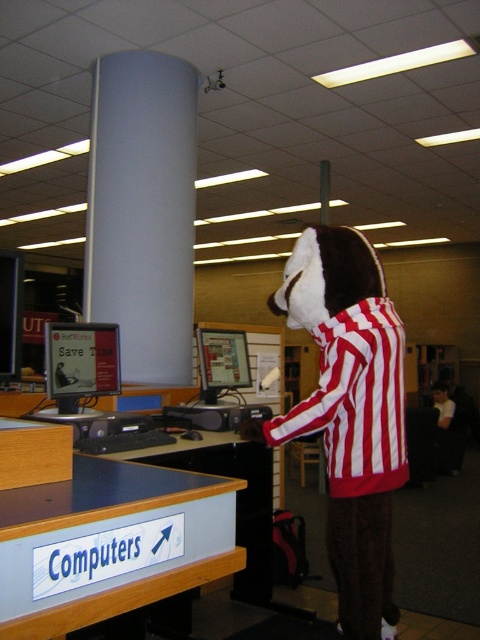
Is white smooth pillar at center thinner than matte black monitor at center?

Incorrect, white smooth pillar at center's width is not less than matte black monitor at center's.

Is point (192, 148) more distant than point (97, 384)?

Yes, point (192, 148) is behind point (97, 384).

This screenshot has width=480, height=640. Identify the location of white smooth pillar at center. (143, 211).

Is red and white striped plush at center further to the viewer compared to blue laminate sign at lower left?

Yes, red and white striped plush at center is further from the viewer.

Which is below, red and white striped plush at center or blue laminate sign at lower left?

Positioned lower is red and white striped plush at center.

Does point (386, 486) come farther from viewer compared to point (47, 496)?

Yes, it is behind point (47, 496).

Image resolution: width=480 pixels, height=640 pixels. Identify the location of red and white striped plush at center. (348, 413).

Between blue laminate sign at lower left and matte black monitor at center, which one has more height?

matte black monitor at center

The image size is (480, 640). I want to click on blue laminate sign at lower left, so click(109, 544).

You are a GUI agent. You are given a task and a screenshot of the screen. Output one action in this format:
    pyautogui.click(x=<x>, y=<y>)
    Task: Click on the blue laminate sign at lower left
    
    Given the screenshot: What is the action you would take?
    pyautogui.click(x=109, y=544)